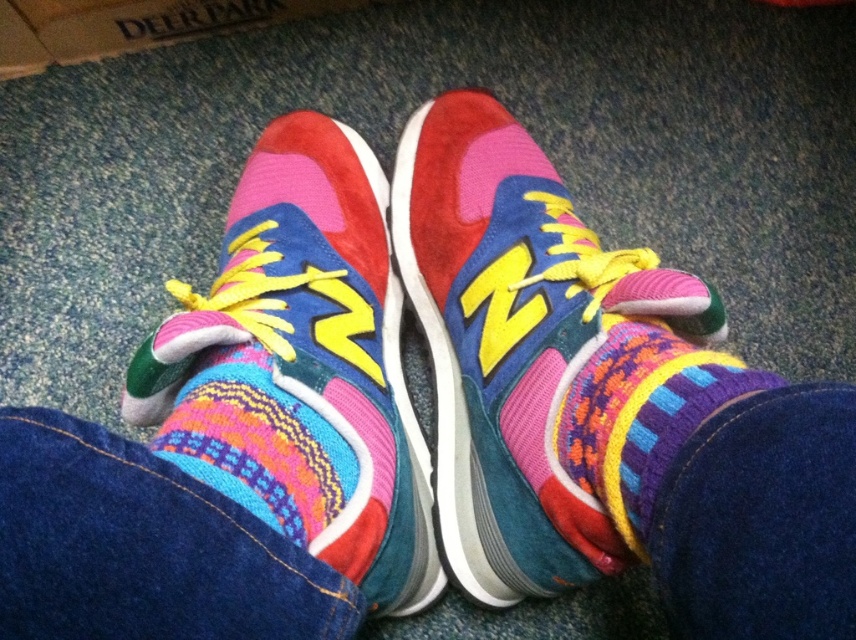
Question: Which object is farther from the camera taking this photo?

Choices:
 (A) suede/multicolored sneaker at center
 (B) cardboard at upper left
 (C) multicolored suede sneaker at center

Answer: (B)

Question: Which of the following is the farthest from the observer?

Choices:
 (A) (613, 326)
 (B) (111, 44)
 (C) (453, 179)
 (D) (318, 406)

Answer: (B)

Question: Is multicolored suede sneaker at center to the right of cardboard at upper left from the viewer's perspective?

Choices:
 (A) yes
 (B) no

Answer: (A)

Question: Is multicolored suede sneaker at center closer to the viewer compared to knitted woolen sock at center?

Choices:
 (A) yes
 (B) no

Answer: (B)

Question: Which is farther from the multicolored suede sneaker at center?

Choices:
 (A) suede/multicolored sneaker at center
 (B) cardboard at upper left

Answer: (B)

Question: Is the position of suede/multicolored sneaker at center less distant than that of cardboard at upper left?

Choices:
 (A) yes
 (B) no

Answer: (A)